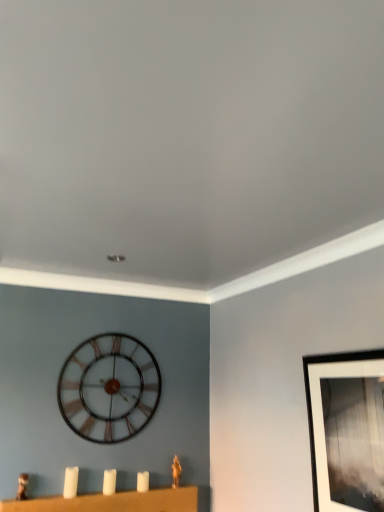
Question: Would you say white matte candlesticks at lower center is to the left or to the right of white matte candle at lower left in the picture?

Choices:
 (A) right
 (B) left

Answer: (A)

Question: In the image, is white matte candlesticks at lower center positioned in front of or behind white matte candle at lower left?

Choices:
 (A) front
 (B) behind

Answer: (A)

Question: Which object is the closest to the white matte candle at lower left?

Choices:
 (A) black matte picture frame at upper right
 (B) white matte candlesticks at lower center
 (C) metallic clock at center

Answer: (B)

Question: Estimate the real-world distances between objects in this image. Which object is farther from the white matte candlesticks at lower center?

Choices:
 (A) black matte picture frame at upper right
 (B) metallic clock at center
 (C) white matte candle at lower left

Answer: (A)